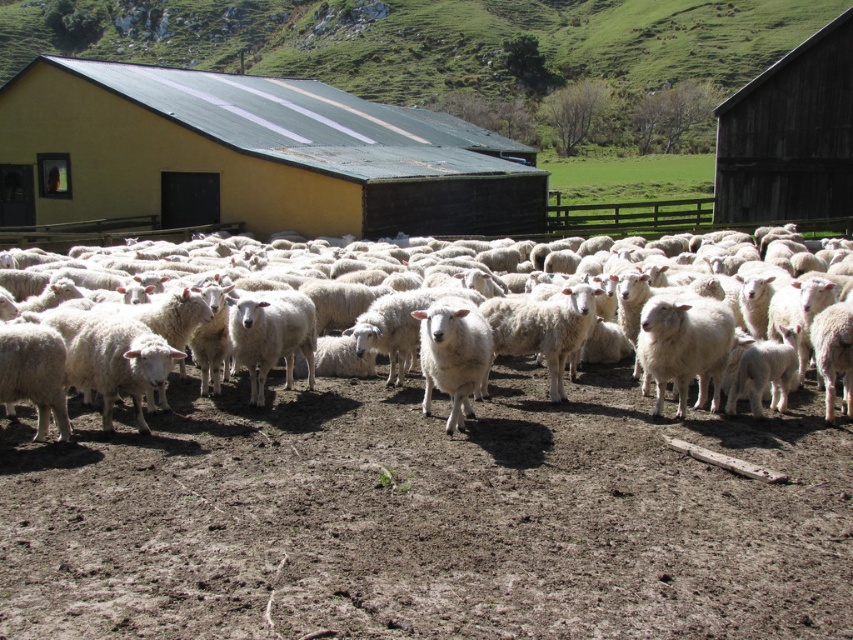
You are a farmer checking the sheep and barn. You want to know if the white woolly sheep at center can fit inside the dark brown wooden barn at upper right. Can it?

The white woolly sheep at center is smaller than the dark brown wooden barn at upper right, so yes, it can fit inside.

You are a farmer standing in the middle of the dirt area where the sheep are gathered. You need to quickly reach the yellow matte barn at center and the dark brown wooden barn at upper right to secure supplies. Which barn should you head to first if you want to minimize your walking distance?

You should head to the yellow matte barn at center first because it is closer to you than the dark brown wooden barn at upper right, so it requires less walking distance.